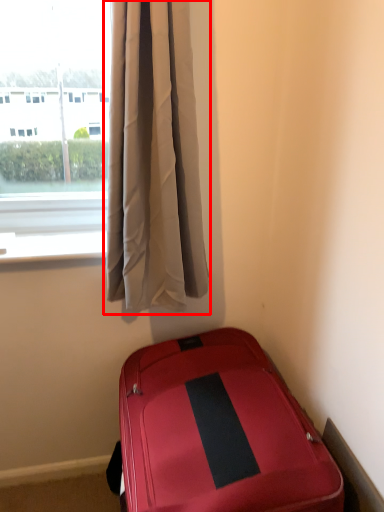
Question: From the image's perspective, where is curtain (annotated by the red box) located in relation to suitcase in the image?

Choices:
 (A) above
 (B) below

Answer: (A)